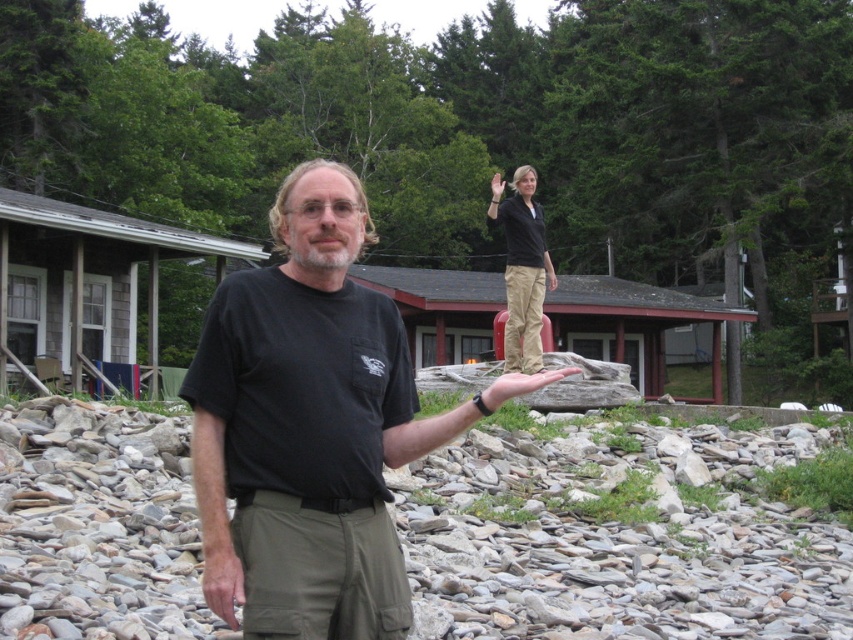
You are standing at the point marked by coordinates point (x=172, y=611) and want to move towards the point marked by coordinates point (x=264, y=627). Is the point you want to reach in front of or behind you?

Point (x=172, y=611) is behind point (x=264, y=627), so the point you want to reach is in front of you.

You are a hiker trying to cross the rocky terrain to reach the person wearing khaki pants at center. The gray smooth rocks at lower center are your current position. Given that the distance between them is 6.88 meters, can you safely jump across if your maximum jump distance is 2 meters?

The gray smooth rocks at lower center and khaki pants at center are 6.88 meters apart. Since your maximum jump distance is 2 meters, you cannot safely jump across the 6.88 meters gap between them.